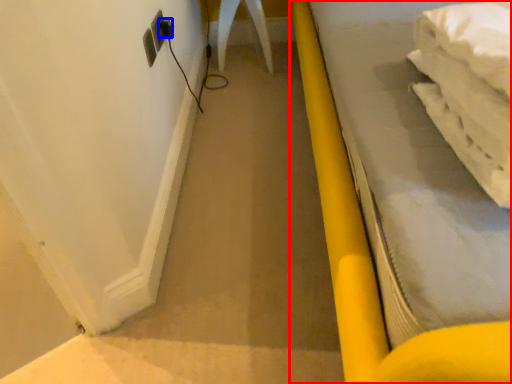
Question: Which object appears farthest to the camera in this image, furniture (highlighted by a red box) or plug (highlighted by a blue box)?

Choices:
 (A) furniture
 (B) plug

Answer: (B)